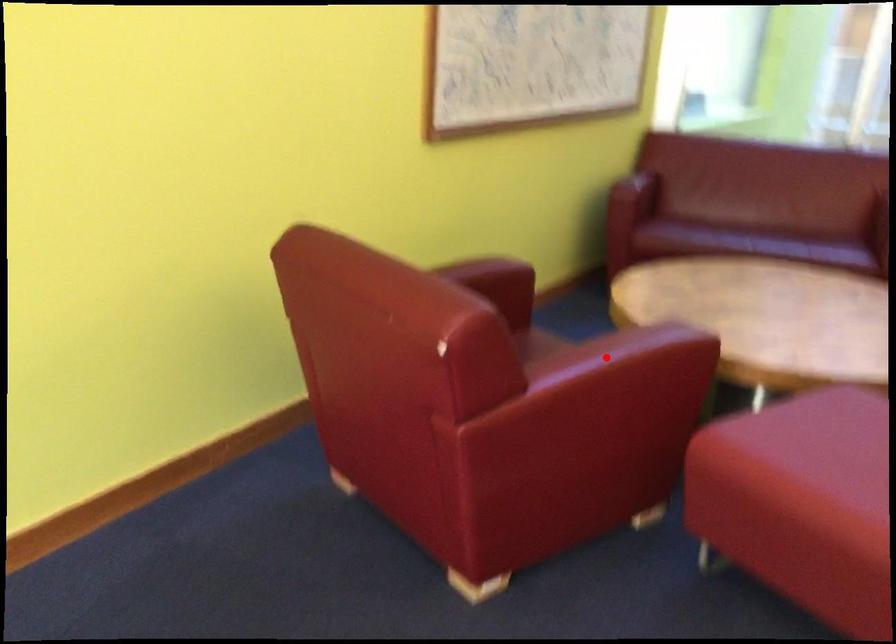
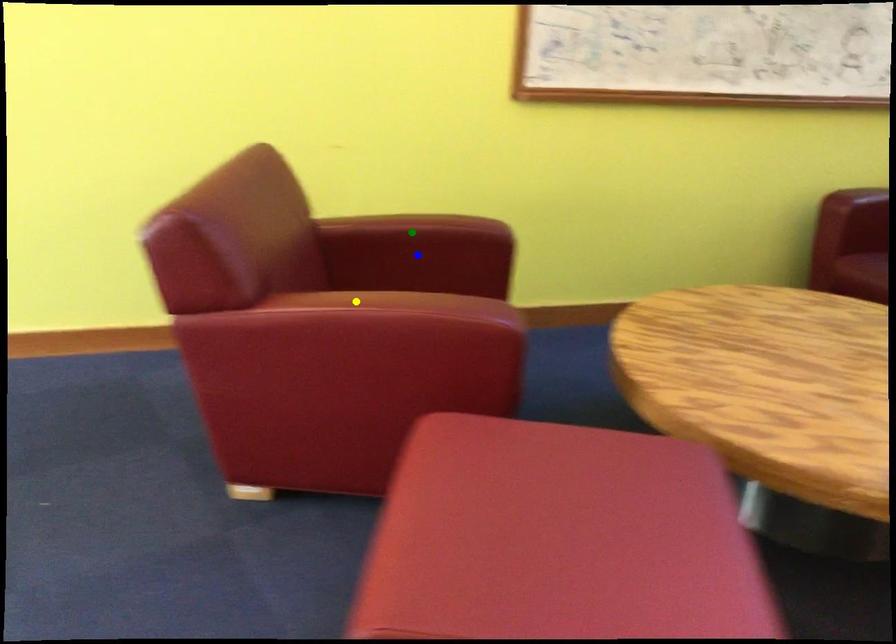
Question: I am providing you with two images of the same scene from different viewpoints. A red point is marked on the first image. You are given multiple points on the second image. Which point in image 2 is actually the same real-world point as the red point in image 1?

Choices:
 (A) yellow point
 (B) green point
 (C) blue point

Answer: (A)